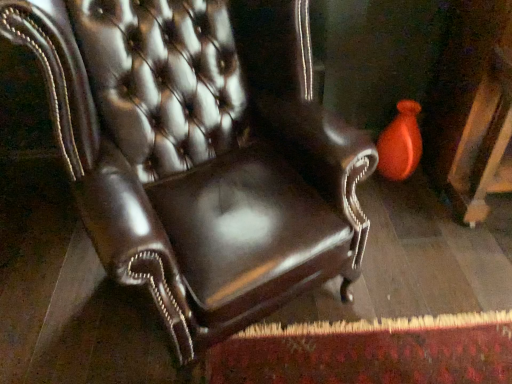
Locate an element on the screen. The width and height of the screenshot is (512, 384). vacant point to the right of orange glossy vase at upper right is located at coordinates (421, 187).